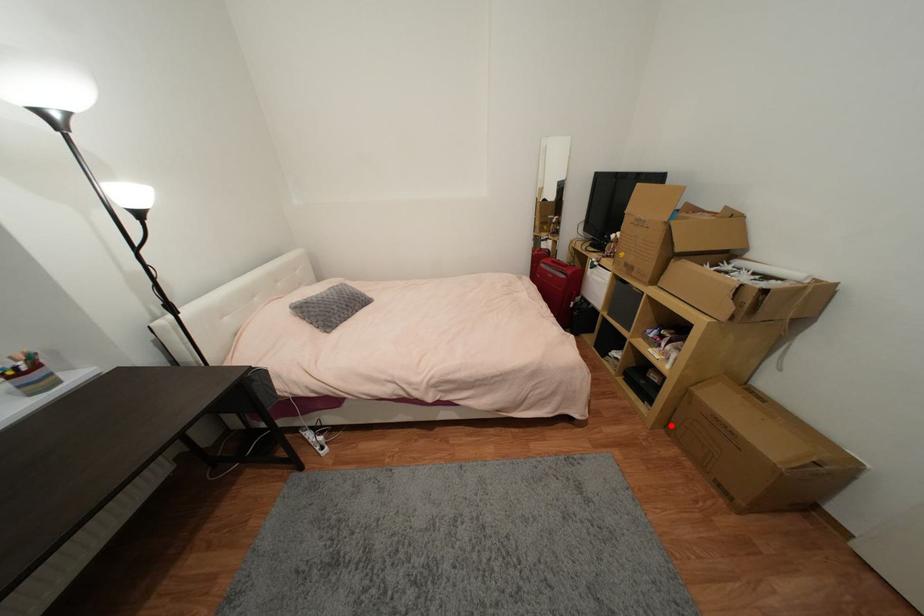
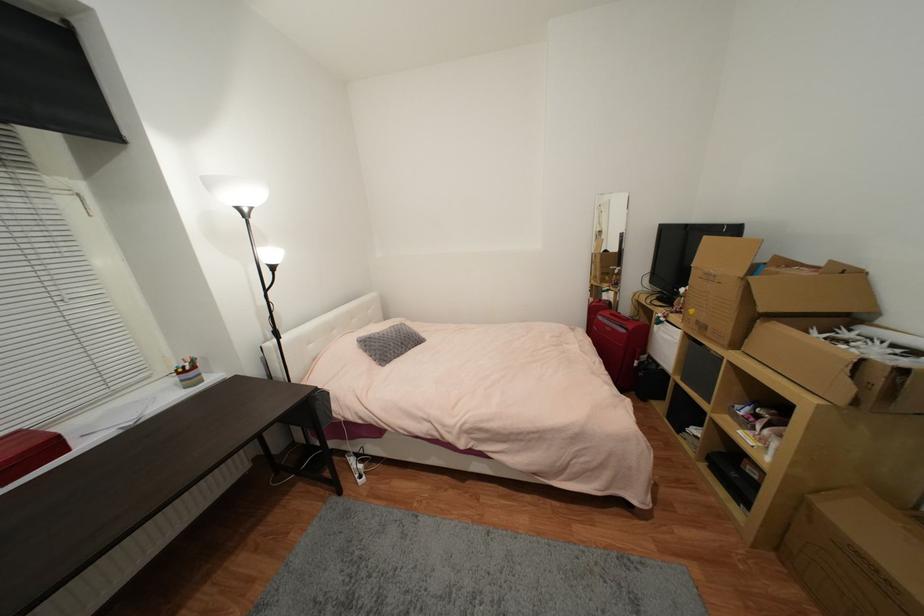
Question: I am providing you with two images of the same scene from different viewpoints. A red point is marked on the first image. Can you still see the location of the red point in image 2?

Choices:
 (A) Yes
 (B) No

Answer: (A)